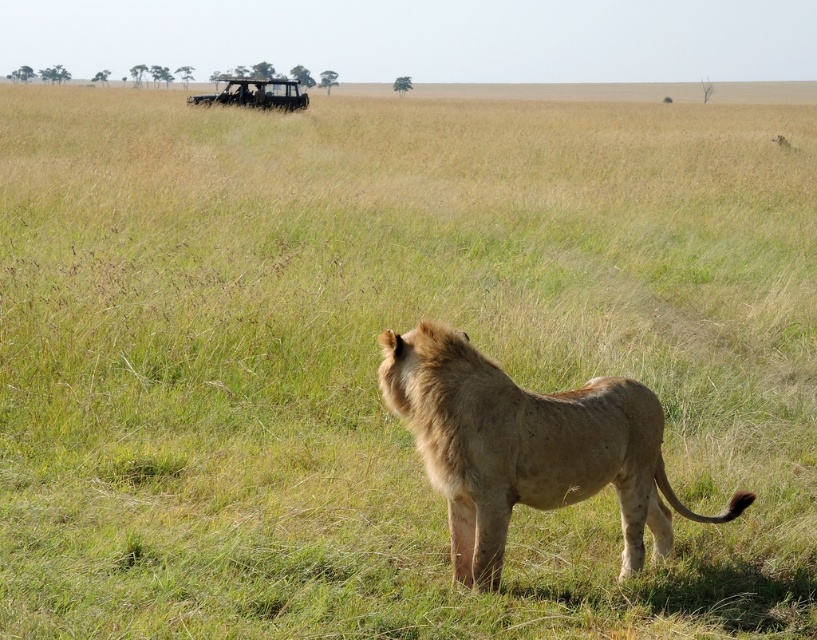
Question: Does golden fur lion at center have a lesser width compared to metallic silver jeep at upper center?

Choices:
 (A) yes
 (B) no

Answer: (A)

Question: Is the position of golden fur lion at center more distant than that of metallic silver jeep at upper center?

Choices:
 (A) no
 (B) yes

Answer: (A)

Question: Which object is farther from the camera taking this photo?

Choices:
 (A) metallic silver jeep at upper center
 (B) golden fur lion at center

Answer: (A)

Question: Which of the following is the farthest from the observer?

Choices:
 (A) (548, 502)
 (B) (253, 106)

Answer: (B)

Question: Is golden fur lion at center to the left of metallic silver jeep at upper center from the viewer's perspective?

Choices:
 (A) yes
 (B) no

Answer: (B)